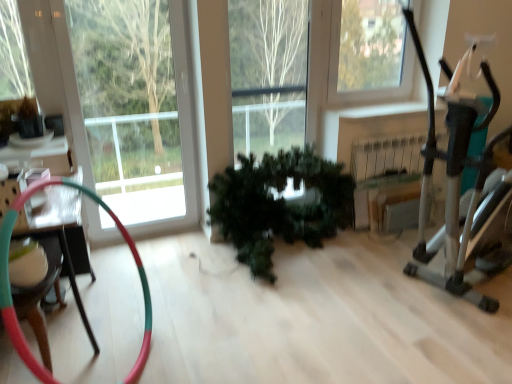
In order to face multicolored rubber hose at left, should I rotate leftwards or rightwards?

Turn left by 21.373 degrees to look at multicolored rubber hose at left.

Where is `multicolored rubber hose at left`? The image size is (512, 384). multicolored rubber hose at left is located at coordinates (11, 294).

Measure the distance between point (270, 250) and camera.

Point (270, 250) and camera are 9.04 feet apart.

The height and width of the screenshot is (384, 512). I want to click on multicolored rubber hose at left, so click(11, 294).

Between metallic silver exercise machine at right and green matte plant at center, which one has smaller size?

green matte plant at center is smaller.

Does point (445, 158) lie in front of point (250, 156)?

That is True.

From the image's perspective, is metallic silver exercise machine at right on green matte plant at center?

Yes, from the image's perspective, metallic silver exercise machine at right is over green matte plant at center.

Can you tell me how much green matte plant at center and multicolored rubber hose at left differ in facing direction?

They differ by 66 degrees in their facing directions.

Is point (270, 262) positioned after point (38, 366)?

Yes, it is behind point (38, 366).

From the picture: Which of these two, green matte plant at center or multicolored rubber hose at left, is wider?

Wider between the two is green matte plant at center.

From the picture: Is green matte plant at center oriented towards multicolored rubber hose at left?

No.

At what (x,y) coordinates should I click in order to perform the action: click on baby carriage in front of the clear glass window at upper right. Please return your answer as a coordinate pair (x, y). The height and width of the screenshot is (384, 512). Looking at the image, I should click on (459, 176).

Is metallic silver exercise machine at right thinner than clear glass window at upper right?

Incorrect, the width of metallic silver exercise machine at right is not less than that of clear glass window at upper right.

How much distance is there between metallic silver exercise machine at right and clear glass window at upper right?

1.30 meters.

In the scene shown: Is metallic silver exercise machine at right located outside clear glass window at upper right?

Yes.

Which of these two, green matte plant at center or clear glass window at upper right, is bigger?

green matte plant at center is bigger.

Does green matte plant at center have a lesser width compared to clear glass window at upper right?

In fact, green matte plant at center might be wider than clear glass window at upper right.

Is the surface of green matte plant at center in direct contact with clear glass window at upper right?

No, green matte plant at center is not with clear glass window at upper right.

Which is further, (x=252, y=158) or (x=344, y=94)?

The point (x=344, y=94) is farther.

Locate an element on the screen. houseplant behind the metallic silver exercise machine at right is located at coordinates (279, 204).

Considering the relative positions of green matte plant at center and metallic silver exercise machine at right in the image provided, is green matte plant at center in front of metallic silver exercise machine at right?

No, it is behind metallic silver exercise machine at right.

Are clear glass window at upper right and metallic silver exercise machine at right located far from each other?

Yes, clear glass window at upper right and metallic silver exercise machine at right are located far from each other.

In terms of height, does clear glass window at upper right look taller or shorter compared to metallic silver exercise machine at right?

clear glass window at upper right is shorter than metallic silver exercise machine at right.

From the image's perspective, who appears lower, clear glass window at upper right or metallic silver exercise machine at right?

metallic silver exercise machine at right appears lower in the image.

Looking at this image, is clear glass window at upper right smaller than green matte plant at center?

Yes.

Between clear glass window at upper right and green matte plant at center, which one has less height?

green matte plant at center.

I want to click on window above the green matte plant at center (from the image's perspective), so click(x=369, y=53).

Is clear glass window at upper right facing towards green matte plant at center?

No, clear glass window at upper right is not aimed at green matte plant at center.

The height and width of the screenshot is (384, 512). I want to click on baby carriage located above the green matte plant at center (from a real-world perspective), so click(459, 176).

The image size is (512, 384). In the image, there is a green matte plant at center. In order to click on garden hose below it (from the image's perspective) in this screenshot , I will do `click(11, 294)`.

Looking at the image, which one is located closer to metallic silver exercise machine at right, clear glass window at upper right or multicolored rubber hose at left?

clear glass window at upper right lies closer to metallic silver exercise machine at right than the other object.

Looking at the image, which one is located further to clear glass window at upper right, green matte plant at center or metallic silver exercise machine at right?

metallic silver exercise machine at right.

Consider the image. Which object lies nearer to the anchor point green matte plant at center, metallic silver exercise machine at right or clear glass window at upper right?

Based on the image, metallic silver exercise machine at right appears to be nearer to green matte plant at center.

From the image, which object appears to be farther from green matte plant at center, clear glass window at upper right or multicolored rubber hose at left?

Based on the image, multicolored rubber hose at left appears to be further to green matte plant at center.

Based on their spatial positions, is clear glass window at upper right or green matte plant at center further from multicolored rubber hose at left?

Based on the image, clear glass window at upper right appears to be further to multicolored rubber hose at left.

Which object lies further to the anchor point metallic silver exercise machine at right, green matte plant at center or clear glass window at upper right?

clear glass window at upper right.

Based on their spatial positions, is green matte plant at center or multicolored rubber hose at left further from metallic silver exercise machine at right?

multicolored rubber hose at left is further to metallic silver exercise machine at right.

From the image, which object appears to be farther from green matte plant at center, metallic silver exercise machine at right or multicolored rubber hose at left?

multicolored rubber hose at left lies further to green matte plant at center than the other object.

At what (x,y) coordinates should I click in order to perform the action: click on houseplant between multicolored rubber hose at left and clear glass window at upper right in the front-back direction. Please return your answer as a coordinate pair (x, y). The image size is (512, 384). Looking at the image, I should click on (279, 204).

Locate an element on the screen. This screenshot has width=512, height=384. window located between multicolored rubber hose at left and metallic silver exercise machine at right in the left-right direction is located at coordinates (369, 53).

Find the location of a particular element. The width and height of the screenshot is (512, 384). houseplant between multicolored rubber hose at left and metallic silver exercise machine at right is located at coordinates (279, 204).

Where is `houseplant between metallic silver exercise machine at right and clear glass window at upper right along the z-axis`? houseplant between metallic silver exercise machine at right and clear glass window at upper right along the z-axis is located at coordinates (279, 204).